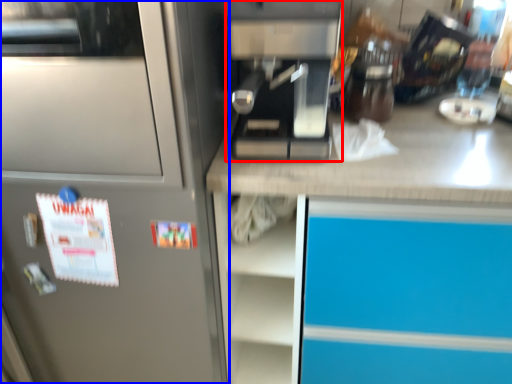
Question: Which object appears closest to the camera in this image, kitchen appliance (highlighted by a red box) or home appliance (highlighted by a blue box)?

Choices:
 (A) kitchen appliance
 (B) home appliance

Answer: (B)